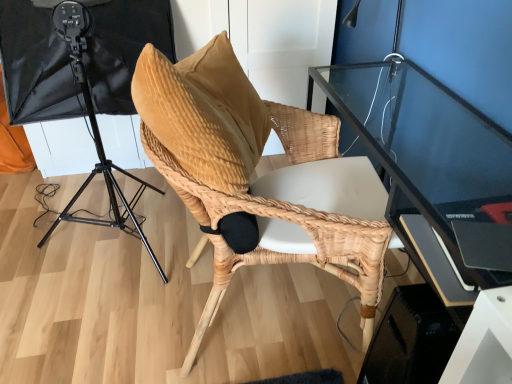
Question: Is natural woven chair at center in front of black matte tripod at left?

Choices:
 (A) yes
 (B) no

Answer: (A)

Question: Considering the relative positions of natural woven chair at center and black matte tripod at left in the image provided, is natural woven chair at center to the right of black matte tripod at left from the viewer's perspective?

Choices:
 (A) no
 (B) yes

Answer: (B)

Question: Considering the relative positions of natural woven chair at center and black matte tripod at left in the image provided, is natural woven chair at center behind black matte tripod at left?

Choices:
 (A) no
 (B) yes

Answer: (A)

Question: Can you confirm if natural woven chair at center is taller than black matte tripod at left?

Choices:
 (A) no
 (B) yes

Answer: (A)

Question: From a real-world perspective, is natural woven chair at center on black matte tripod at left?

Choices:
 (A) yes
 (B) no

Answer: (B)

Question: Would you consider natural woven chair at center to be distant from black matte tripod at left?

Choices:
 (A) yes
 (B) no

Answer: (B)

Question: Can you confirm if black matte tripod at left is positioned to the left of natural woven chair at center?

Choices:
 (A) yes
 (B) no

Answer: (A)

Question: Does black matte tripod at left lie in front of natural woven chair at center?

Choices:
 (A) yes
 (B) no

Answer: (B)

Question: Is black matte tripod at left smaller than natural woven chair at center?

Choices:
 (A) no
 (B) yes

Answer: (A)

Question: Is the depth of black matte tripod at left greater than that of natural woven chair at center?

Choices:
 (A) no
 (B) yes

Answer: (B)

Question: Considering the relative positions of black matte tripod at left and natural woven chair at center in the image provided, is black matte tripod at left to the right of natural woven chair at center from the viewer's perspective?

Choices:
 (A) yes
 (B) no

Answer: (B)

Question: From a real-world perspective, is black matte tripod at left beneath natural woven chair at center?

Choices:
 (A) yes
 (B) no

Answer: (B)

Question: Considering the positions of natural woven chair at center and black matte tripod at left in the image, is natural woven chair at center bigger or smaller than black matte tripod at left?

Choices:
 (A) big
 (B) small

Answer: (B)